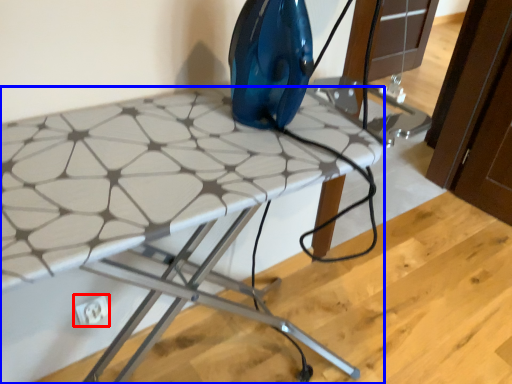
Question: Which object is closer to the camera taking this photo, electric outlet (highlighted by a red box) or table (highlighted by a blue box)?

Choices:
 (A) electric outlet
 (B) table

Answer: (B)